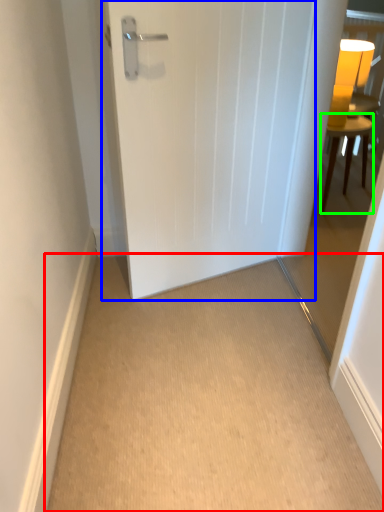
Question: Which is farther away from corridor (highlighted by a red box)? door (highlighted by a blue box) or furniture (highlighted by a green box)?

Choices:
 (A) door
 (B) furniture

Answer: (B)